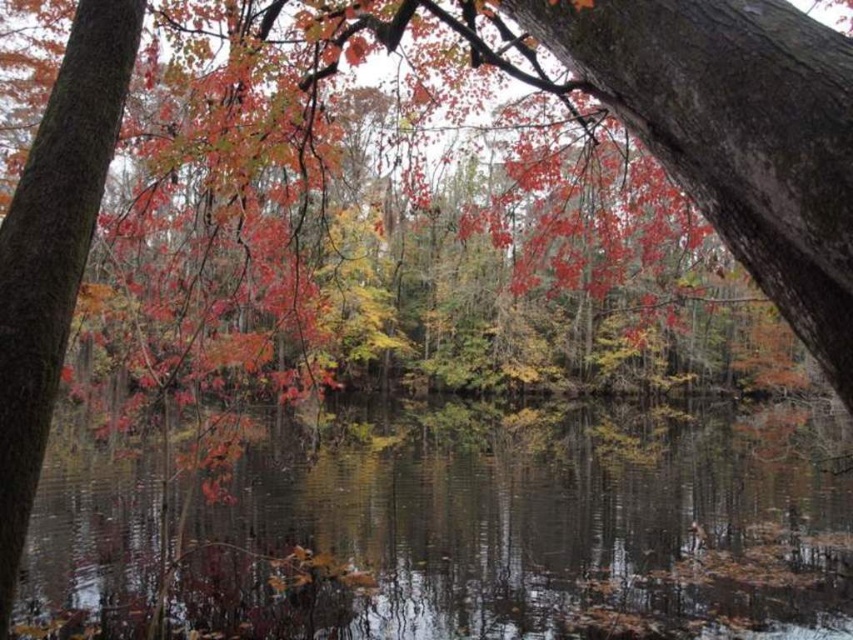
You are standing in the autumn scene and want to take a photo of the smooth reflective water at center and the smooth bark tree trunk at left. Which object is located to the right of the other?

The smooth reflective water at center is positioned on the right side of smooth bark tree trunk at left.

You are standing at the edge of the water and want to place a small floating decoration exactly at the center of the smooth reflective water at center. According to the coordinates provided, where should you aim to place it?

The smooth reflective water at center is located at coordinates point [473,528], so you should aim for that exact point to place the decoration at its center.

You are standing at the edge of the water and want to place a small decorative rock on the smooth reflective water at center and the smooth bark tree trunk at left. Which surface can accommodate the rock without it sinking or being displaced easily?

The smooth reflective water at center has a larger size compared to smooth bark tree trunk at left, so placing the rock on the smooth reflective water at center would allow it to stay without sinking or being displaced easily.